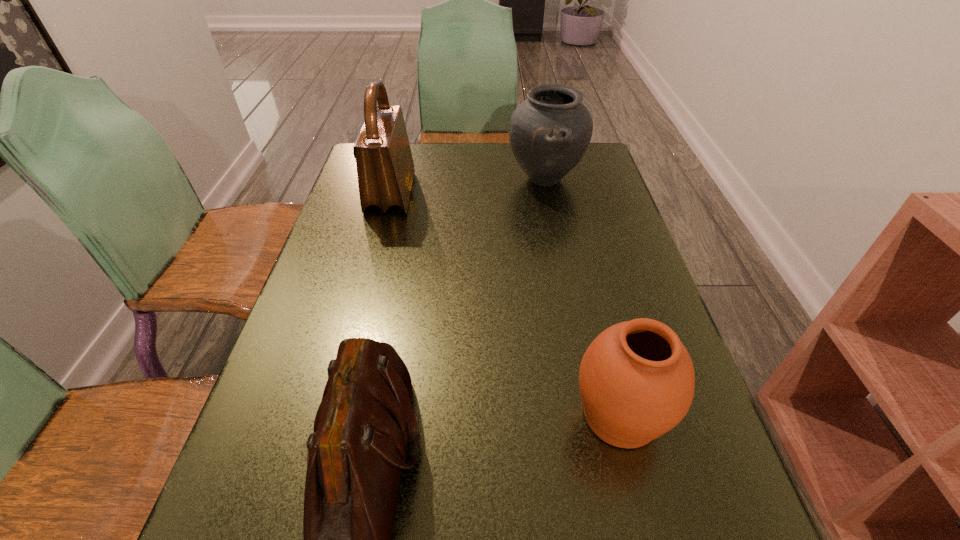
This screenshot has width=960, height=540. I want to click on object at the left edge, so click(x=385, y=168).

The height and width of the screenshot is (540, 960). In order to click on object positioned at the far left corner in this screenshot , I will do `click(385, 168)`.

This screenshot has width=960, height=540. Find the location of `object situated at the far right corner`. object situated at the far right corner is located at coordinates (550, 131).

You are a GUI agent. You are given a task and a screenshot of the screen. Output one action in this format:
    pyautogui.click(x=<x>, y=<y>)
    Task: Click on the vacant area at the far edge
    
    Given the screenshot: What is the action you would take?
    pyautogui.click(x=485, y=144)

In the image, there is a desktop. Identify the location of vacant space at the left edge. Image resolution: width=960 pixels, height=540 pixels. (268, 464).

Find the location of a particular element. The width and height of the screenshot is (960, 540). free space at the right edge of the desktop is located at coordinates (572, 192).

This screenshot has height=540, width=960. I want to click on free space at the far right corner of the desktop, so click(x=600, y=158).

I want to click on blank region between the taller urn and the shortest object, so tap(583, 296).

The height and width of the screenshot is (540, 960). Identify the location of vacant space that is in between the taller shoulder bag and the shortest object. (506, 304).

Where is `object that is the closest to the tallest object`? object that is the closest to the tallest object is located at coordinates (550, 131).